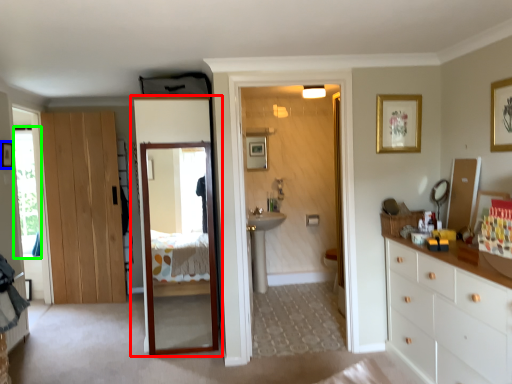
Question: Considering the real-world distances, which object is closest to door (highlighted by a red box)? picture frame (highlighted by a blue box) or window (highlighted by a green box).

Choices:
 (A) picture frame
 (B) window

Answer: (B)